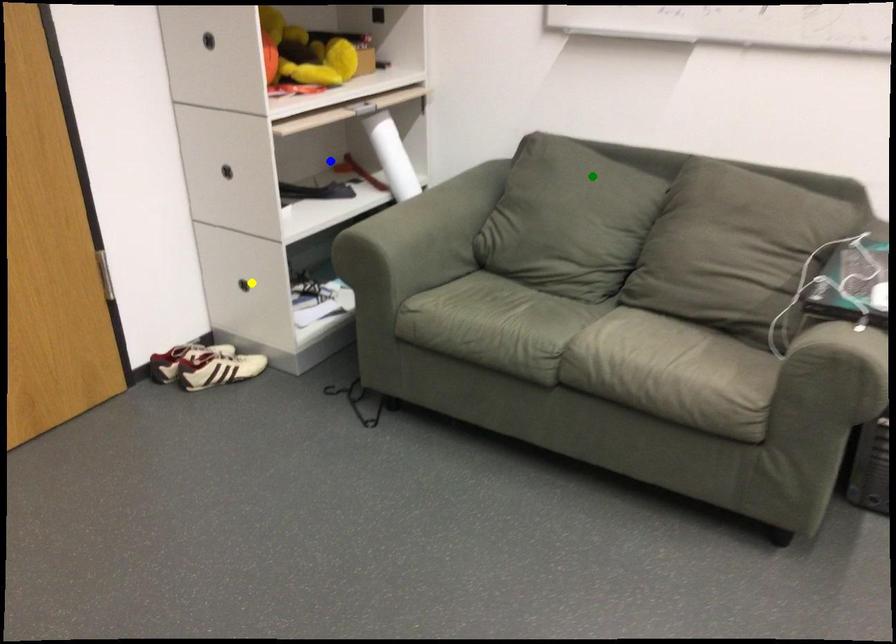
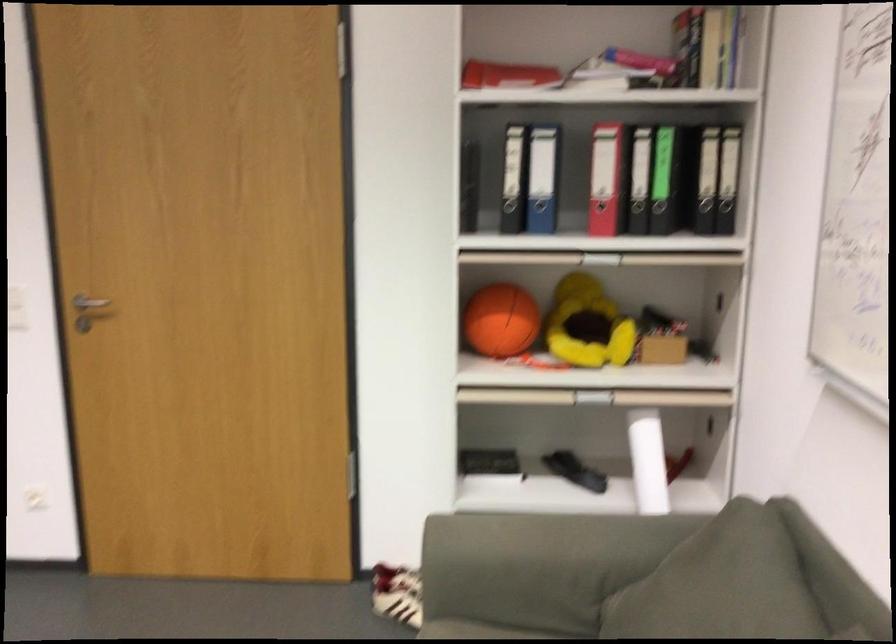
I am providing you with two images of the same scene from different viewpoints. Three points are marked in image1. Which point corresponds to a part or object that is occluded in image2?In image1, three points are marked. Which of them correspond to a part or object that is occluded in image2?Among the three points shown in image1, which one corresponds to a part or object that is no longer visible due to occlusion in image2?

blue point, yellow point